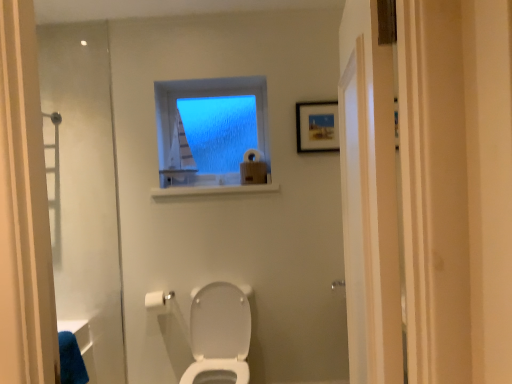
Question: Should I look upward or downward to see white glossy toilet at center?

Choices:
 (A) up
 (B) down

Answer: (B)

Question: Which direction should I rotate to face white matte toilet paper at lower center, which is the 1th toilet paper in left-to-right order, — up or down?

Choices:
 (A) up
 (B) down

Answer: (B)

Question: Does blue frosted glass window at upper center have a lesser height compared to white matte toilet paper at lower center, which ranks as the 1th toilet paper in front-to-back order?

Choices:
 (A) no
 (B) yes

Answer: (A)

Question: Is blue frosted glass window at upper center taller than white matte toilet paper at lower center, which is the 1th toilet paper in left-to-right order?

Choices:
 (A) no
 (B) yes

Answer: (B)

Question: Would you say blue frosted glass window at upper center is a long distance from white matte toilet paper at lower center, acting as the 2th toilet paper starting from the right?

Choices:
 (A) no
 (B) yes

Answer: (B)

Question: From the image's perspective, would you say blue frosted glass window at upper center is shown under white matte toilet paper at lower center, which is the 1th toilet paper in left-to-right order?

Choices:
 (A) no
 (B) yes

Answer: (A)

Question: Is blue frosted glass window at upper center oriented away from white matte toilet paper at lower center, the first toilet paper ordered from the bottom?

Choices:
 (A) no
 (B) yes

Answer: (A)

Question: Is blue frosted glass window at upper center to the left of white matte toilet paper at lower center, the second toilet paper from the top, from the viewer's perspective?

Choices:
 (A) no
 (B) yes

Answer: (A)

Question: From the image's perspective, does wooden framed picture at upper right appear lower than blue frosted glass window at upper center?

Choices:
 (A) yes
 (B) no

Answer: (B)

Question: Does wooden framed picture at upper right turn towards blue frosted glass window at upper center?

Choices:
 (A) no
 (B) yes

Answer: (A)

Question: From a real-world perspective, is wooden framed picture at upper right on top of blue frosted glass window at upper center?

Choices:
 (A) yes
 (B) no

Answer: (A)

Question: Is wooden framed picture at upper right positioned before blue frosted glass window at upper center?

Choices:
 (A) yes
 (B) no

Answer: (A)

Question: From a real-world perspective, does wooden framed picture at upper right sit lower than blue frosted glass window at upper center?

Choices:
 (A) no
 (B) yes

Answer: (A)

Question: Is wooden framed picture at upper right wider than blue frosted glass window at upper center?

Choices:
 (A) no
 (B) yes

Answer: (A)

Question: From a real-world perspective, is white glossy toilet at center located higher than white matte toilet paper at upper center, the 1th toilet paper positioned from the back?

Choices:
 (A) yes
 (B) no

Answer: (B)